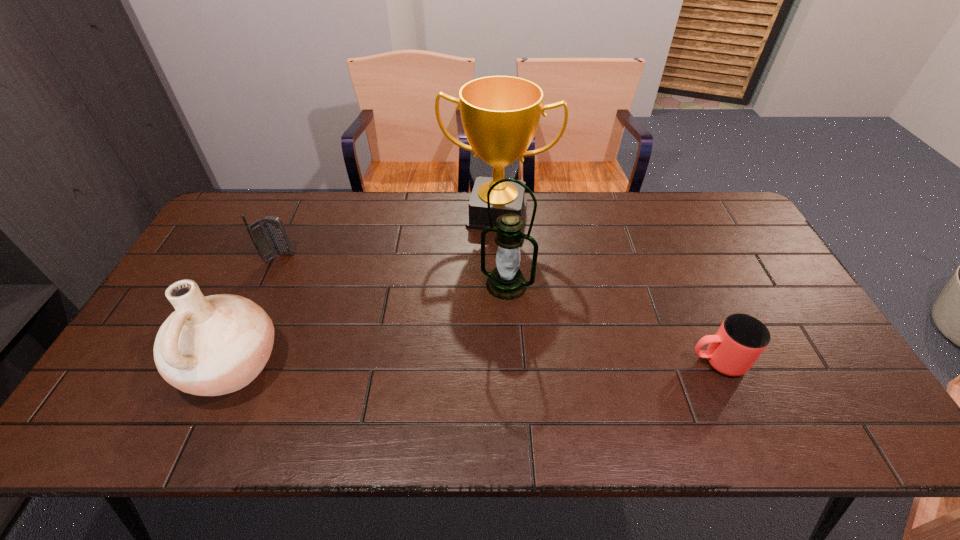
Identify the location of pottery. (214, 345).

Locate an element on the screen. the rightmost object is located at coordinates (741, 339).

The width and height of the screenshot is (960, 540). Identify the location of the shortest object. (741, 339).

Identify the location of the second shortest object. (269, 236).

I want to click on the fourth nearest object, so click(269, 236).

The width and height of the screenshot is (960, 540). I want to click on lantern, so click(x=506, y=282).

Locate an element on the screen. The image size is (960, 540). the third farthest object is located at coordinates (506, 282).

Locate an element on the screen. The height and width of the screenshot is (540, 960). the farthest object is located at coordinates (500, 114).

Locate an element on the screen. vacant point located 0.070m to pour from the handle of the third shortest object is located at coordinates (155, 365).

Where is `free region located to pour from the handle of the third shortest object`? free region located to pour from the handle of the third shortest object is located at coordinates (142, 365).